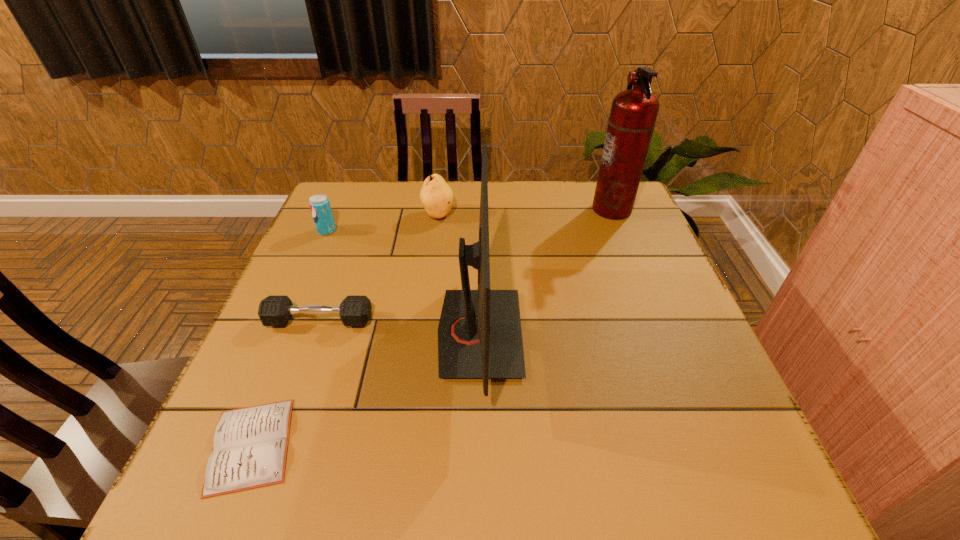
Find the location of `dumbbell positioned at the left edge`. dumbbell positioned at the left edge is located at coordinates (273, 310).

Locate an element on the screen. diary situated at the left edge is located at coordinates (250, 446).

Identify the location of object that is positioned at the right edge. The width and height of the screenshot is (960, 540). (633, 114).

The height and width of the screenshot is (540, 960). I want to click on object located at the near left corner, so click(250, 446).

The height and width of the screenshot is (540, 960). What are the coordinates of `object that is positioned at the far right corner` in the screenshot? It's located at (633, 114).

I want to click on vacant space at the far edge of the desktop, so click(498, 183).

At what (x,y) coordinates should I click in order to perform the action: click on free space at the near edge of the desktop. Please return your answer as a coordinate pair (x, y). The height and width of the screenshot is (540, 960). Looking at the image, I should click on (324, 494).

Locate an element on the screen. Image resolution: width=960 pixels, height=540 pixels. vacant region at the left edge is located at coordinates (293, 377).

The width and height of the screenshot is (960, 540). I want to click on free spot between the monitor and the diary, so click(x=366, y=389).

At what (x,y) coordinates should I click in order to perform the action: click on free space between the monitor and the diary. Please return your answer as a coordinate pair (x, y). The height and width of the screenshot is (540, 960). Looking at the image, I should click on (366, 389).